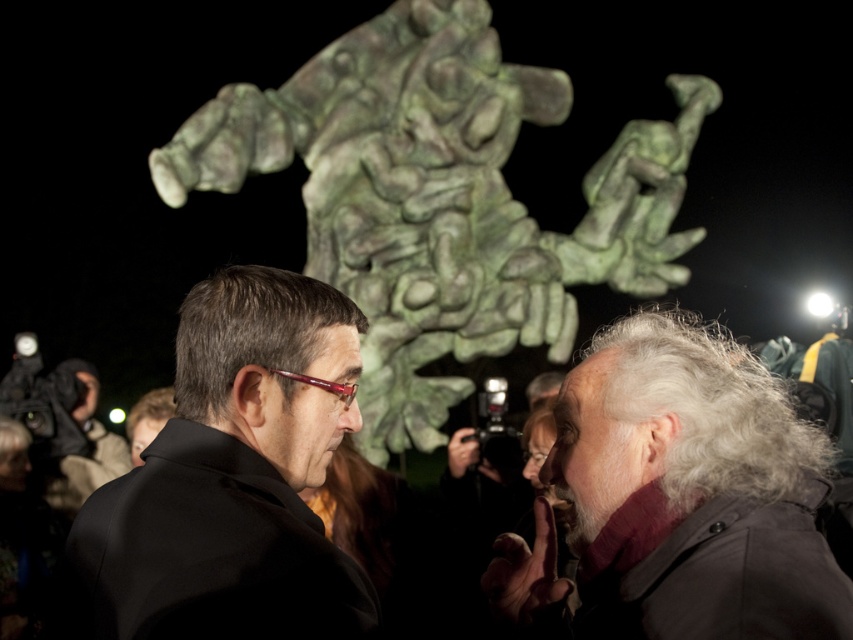
You are a photographer trying to capture both the gray woolen scarf at lower right and the black matte suit at center in a single frame. Based on their heights, which object should you focus on first to ensure both are in focus?

The gray woolen scarf at lower right has a lesser height compared to the black matte suit at center. To ensure both are in focus, you should focus on the taller object first, which is the black matte suit at center, as it will help maintain depth of field for the shorter gray woolen scarf at lower right.

You are a photographer standing at the position of the two people in the scene. You want to take a photo that includes both the green patina stone sculpture at upper center and the gray woolen scarf at lower right. Given that your camera has a maximum zoom range of 10 meters, will you be able to capture both objects in a single frame without moving your position?

The green patina stone sculpture at upper center and gray woolen scarf at lower right are 14.49 meters apart from each other. Since your camera can only zoom up to 10 meters, you cannot capture both objects in a single frame without moving your position because the distance between them exceeds the maximum zoom range.

Looking at this image, you are a photographer standing at the edge of the scene. You want to take a photo of the black matte suit at center without the green patina stone sculpture at upper center appearing in the frame. Is this possible?

The green patina stone sculpture at upper center is positioned over the black matte suit at center, so it will block the view. Therefore, it is not possible to take a photo of the black matte suit at center without the sculpture appearing in the frame.